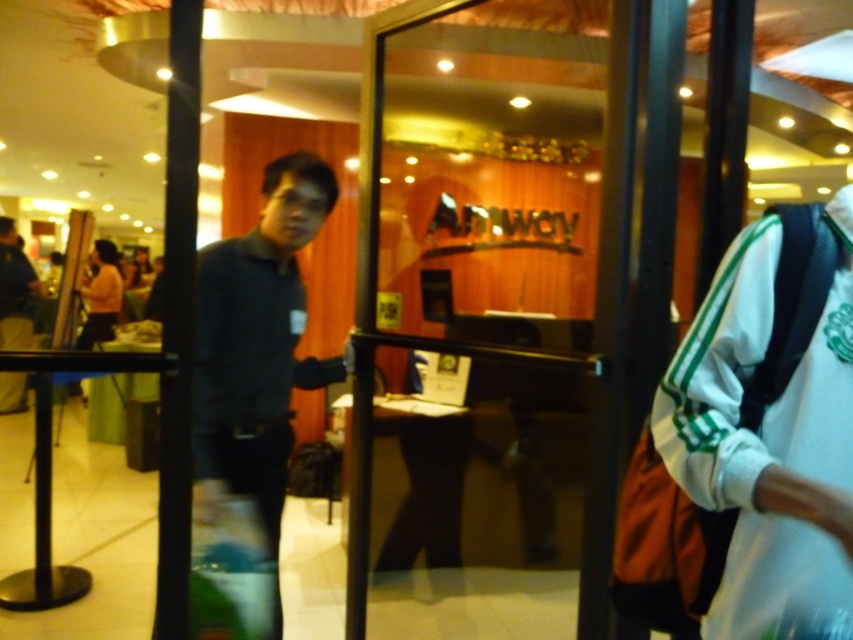
You are standing in the reception area and need to exit through the transparent glass door at center. However, there is a person wearing a dark blue shirt at center blocking your path. Which direction should you move to go around them and reach the door?

Since the transparent glass door at center is to the right of the dark blue shirt at center, you should move to the right side of the dark blue shirt at center to reach the door.

You are standing at the entrance of the venue and see the transparent glass door at center and the dark blue shirt at center. Which object is closer to you?

The transparent glass door at center is positioned over the dark blue shirt at center, meaning it is closer to you.